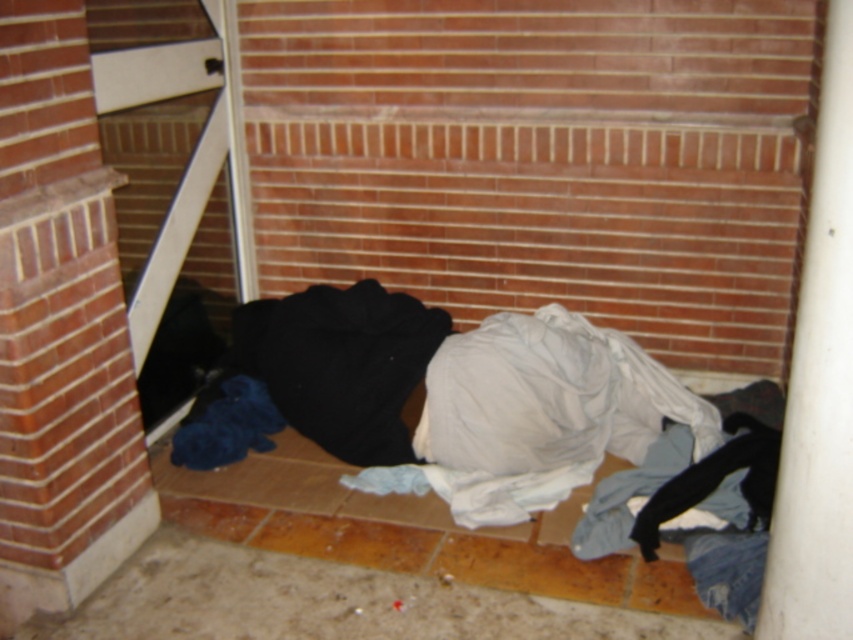
Can you confirm if white cotton laundry at center is smaller than black fuzzy blanket at center?

No, white cotton laundry at center is not smaller than black fuzzy blanket at center.

Can you confirm if white cotton laundry at center is wider than black fuzzy blanket at center?

Correct, the width of white cotton laundry at center exceeds that of black fuzzy blanket at center.

Is point (560, 424) behind point (296, 310)?

No, (560, 424) is in front of (296, 310).

Image resolution: width=853 pixels, height=640 pixels. What are the coordinates of `white cotton laundry at center` in the screenshot? It's located at (480, 404).

Who is lower down, white cotton laundry at center or white smooth pipe at right?

white cotton laundry at center is lower down.

Does white cotton laundry at center lie behind white smooth pipe at right?

Yes, white cotton laundry at center is further from the viewer.

Is point (563, 365) farther from viewer compared to point (836, 205)?

Yes, it is behind point (836, 205).

I want to click on white cotton laundry at center, so click(480, 404).

Does white smooth pipe at right have a smaller size compared to black fuzzy blanket at center?

Indeed, white smooth pipe at right has a smaller size compared to black fuzzy blanket at center.

How much distance is there between white smooth pipe at right and black fuzzy blanket at center?

white smooth pipe at right is 1.45 meters from black fuzzy blanket at center.

Is point (828, 332) closer to camera compared to point (370, 433)?

Yes, it is in front of point (370, 433).

The image size is (853, 640). Find the location of `white smooth pipe at right`. white smooth pipe at right is located at coordinates (819, 381).